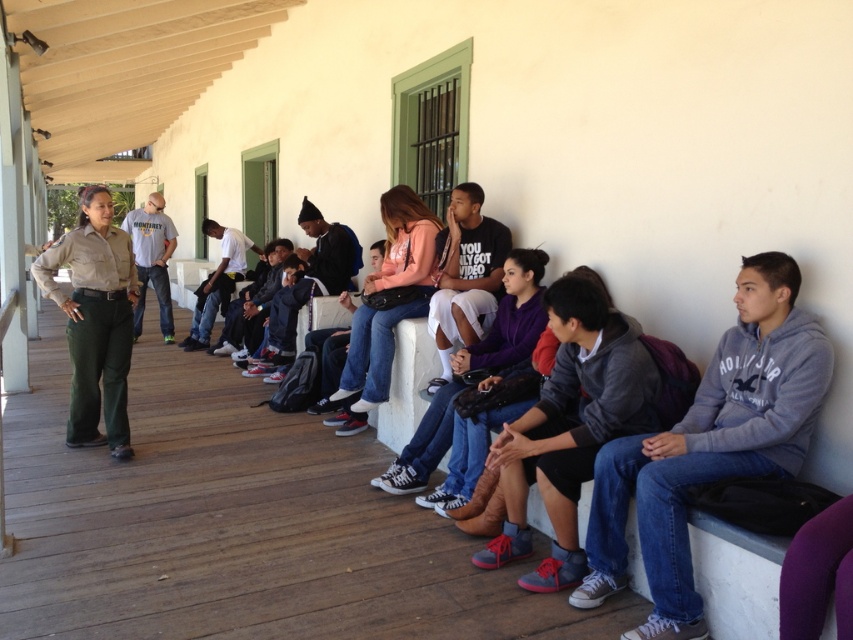
Between gray fleece sweatshirt at center and khaki uniform pants at left, which one has more height?

With more height is khaki uniform pants at left.

Based on the photo, does gray fleece sweatshirt at center have a smaller size compared to khaki uniform pants at left?

Yes, gray fleece sweatshirt at center is smaller than khaki uniform pants at left.

The image size is (853, 640). What are the coordinates of `gray fleece sweatshirt at center` in the screenshot? It's located at (709, 445).

The height and width of the screenshot is (640, 853). Identify the location of gray fleece sweatshirt at center. (709, 445).

Who is shorter, gray fleece sweatshirt at center or light gray cotton shirt at center?

gray fleece sweatshirt at center

Locate an element on the screen. The height and width of the screenshot is (640, 853). gray fleece sweatshirt at center is located at coordinates (709, 445).

Can you confirm if khaki uniform pants at left is thinner than light gray cotton shirt at center?

Yes, khaki uniform pants at left is thinner than light gray cotton shirt at center.

Which is in front, point (117, 314) or point (131, 218)?

Point (117, 314) is more forward.

Does point (91, 244) lie behind point (170, 307)?

No.

At what (x,y) coordinates should I click in order to perform the action: click on khaki uniform pants at left. Please return your answer as a coordinate pair (x, y). Looking at the image, I should click on (96, 321).